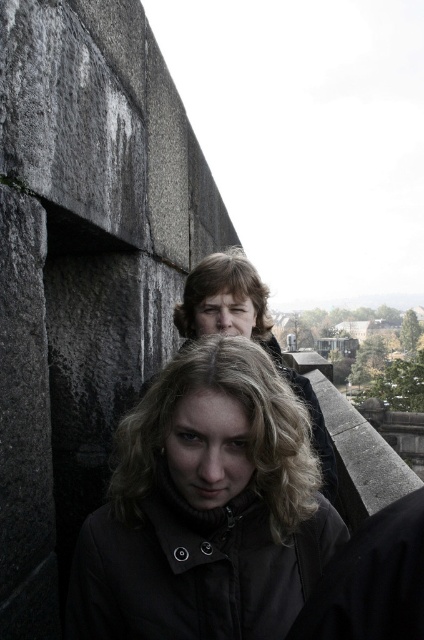
Question: Is matte black jacket at upper center positioned before blonde curly hair at upper center?

Choices:
 (A) yes
 (B) no

Answer: (A)

Question: Does matte black jacket at center lie in front of matte black jacket at upper center?

Choices:
 (A) no
 (B) yes

Answer: (B)

Question: Is matte black jacket at center smaller than matte black jacket at upper center?

Choices:
 (A) yes
 (B) no

Answer: (A)

Question: Based on their relative distances, which object is nearer to the matte black jacket at upper center?

Choices:
 (A) blonde curly hair at upper center
 (B) matte black jacket at center

Answer: (A)

Question: Considering the real-world distances, which object is closest to the blonde curly hair at upper center?

Choices:
 (A) matte black jacket at center
 (B) matte black jacket at upper center

Answer: (B)

Question: Among these objects, which one is nearest to the camera?

Choices:
 (A) blonde curly hair at upper center
 (B) matte black jacket at center

Answer: (B)